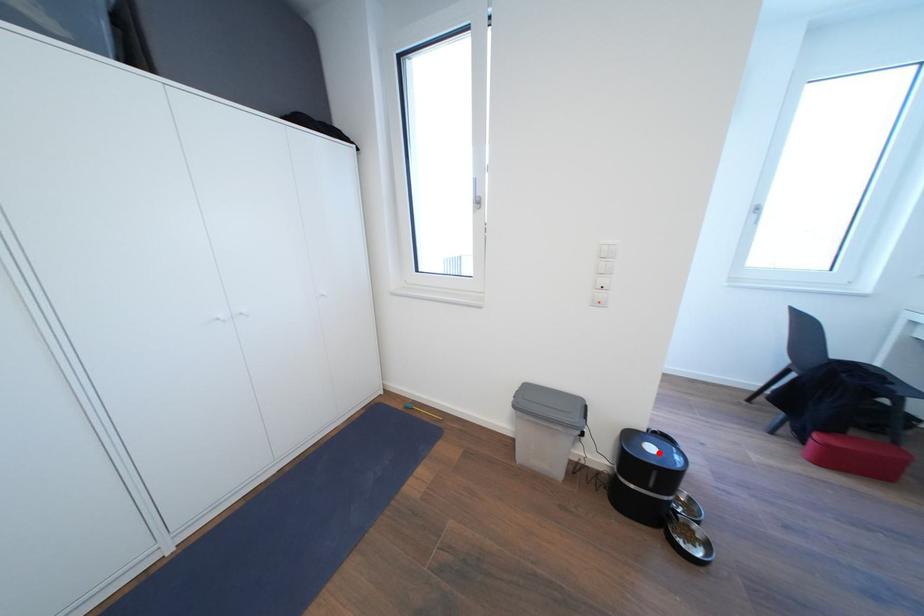
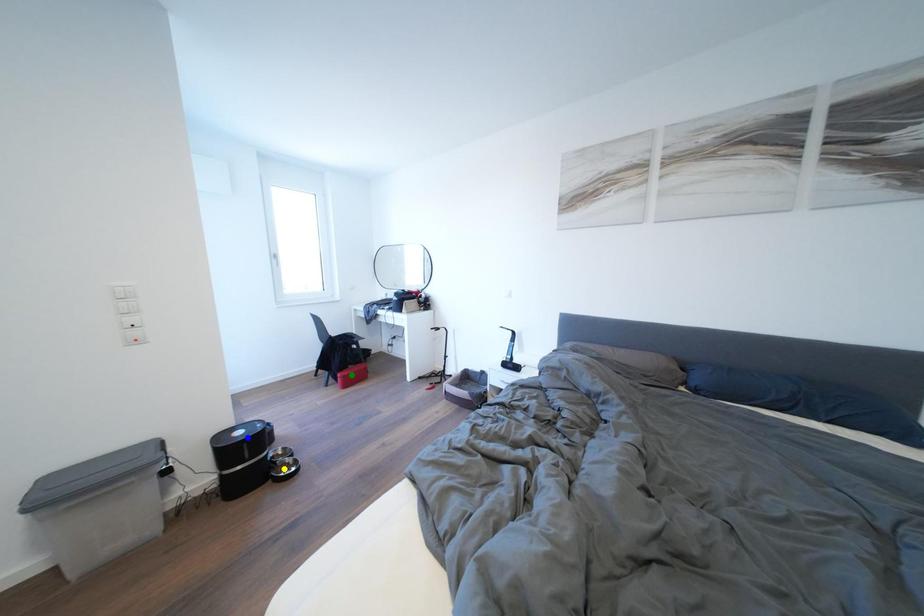
Question: I am providing you with two images of the same scene from different viewpoints. A red point is marked on the first image. You are given multiple points on the second image. Which mark in image 2 goes with the point in image 1?

Choices:
 (A) blue point
 (B) yellow point
 (C) green point

Answer: (A)